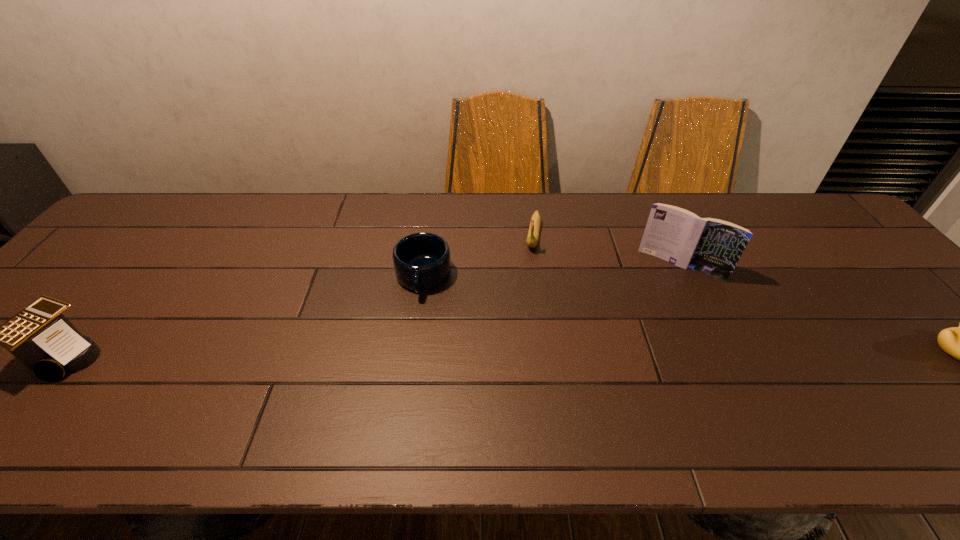
This screenshot has height=540, width=960. In order to click on calculator in this screenshot , I will do `click(40, 336)`.

You are a GUI agent. You are given a task and a screenshot of the screen. Output one action in this format:
    pyautogui.click(x=<x>, y=<y>)
    Task: Click on the tallest object
    Image resolution: width=960 pixels, height=540 pixels.
    Given the screenshot: What is the action you would take?
    pyautogui.click(x=712, y=246)

This screenshot has width=960, height=540. Identify the location of the second object from right to left. (712, 246).

You are a GUI agent. You are given a task and a screenshot of the screen. Output one action in this format:
    pyautogui.click(x=<x>, y=<y>)
    Task: Click on the third object from left to right
    This screenshot has height=540, width=960.
    Given the screenshot: What is the action you would take?
    pyautogui.click(x=533, y=234)

Identify the location of the fourth object from right to left. (421, 260).

At what (x,y) coordinates should I click in order to perform the action: click on vacant space located on the back of the calculator. Please return your answer as a coordinate pair (x, y). This screenshot has height=540, width=960. Looking at the image, I should click on (135, 272).

You are a GUI agent. You are given a task and a screenshot of the screen. Output one action in this format:
    pyautogui.click(x=<x>, y=<y>)
    Task: Click on the vacant region located on the front cover of the book
    This screenshot has height=540, width=960.
    Given the screenshot: What is the action you would take?
    pyautogui.click(x=651, y=316)

I want to click on free point located on the front cover of the book, so click(656, 306).

Where is `free space located on the front cover of the book`? This screenshot has width=960, height=540. free space located on the front cover of the book is located at coordinates (623, 379).

Where is `vacant region located at the stem of the third object from left to right`? The image size is (960, 540). vacant region located at the stem of the third object from left to right is located at coordinates 527,300.